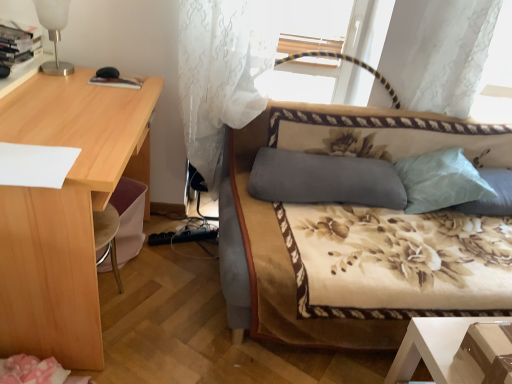
Where is `vacant area that lies to the right of white frosted glass table lamp at upper left`? The width and height of the screenshot is (512, 384). vacant area that lies to the right of white frosted glass table lamp at upper left is located at coordinates (93, 80).